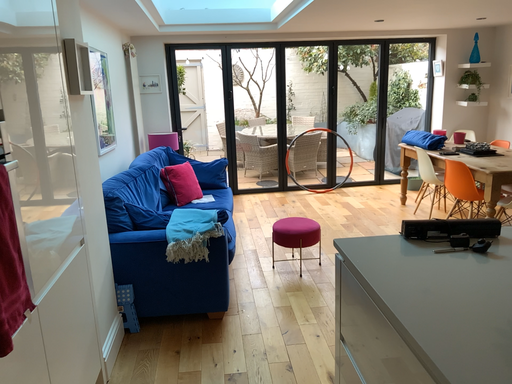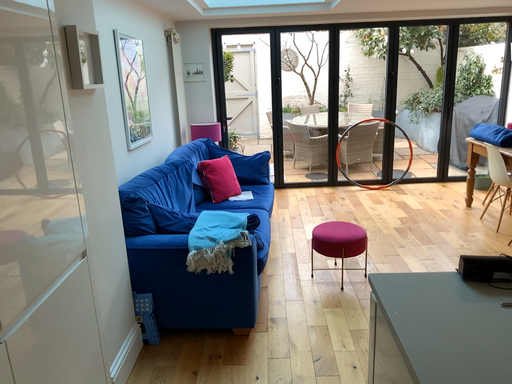
Question: How did the camera likely rotate when shooting the video?

Choices:
 (A) rotated left
 (B) rotated right

Answer: (A)